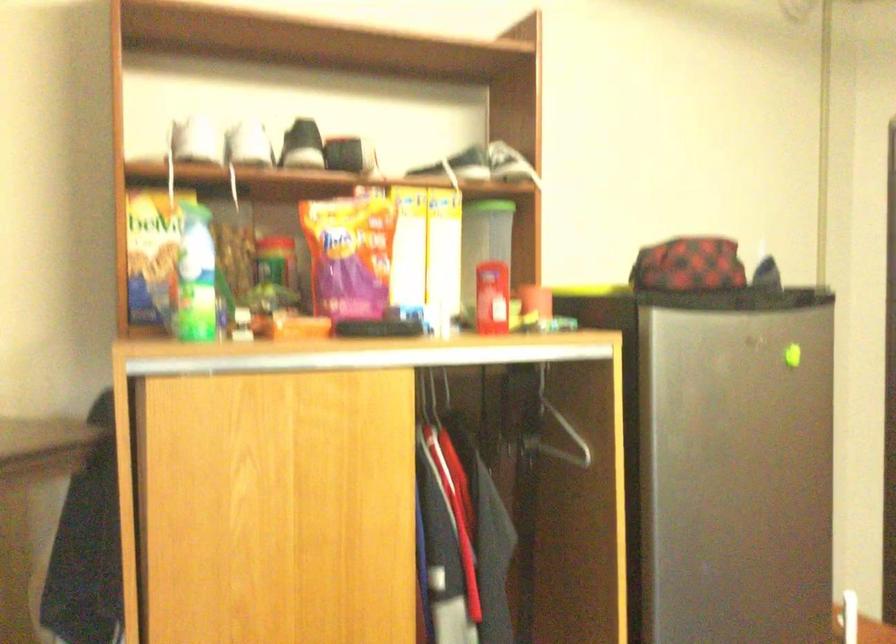
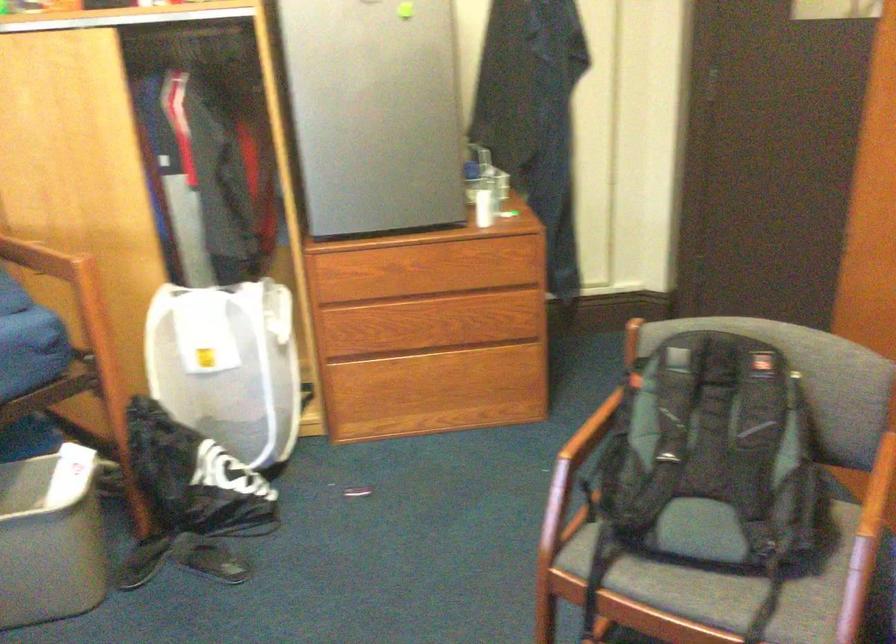
What movement of the cameraman would produce the second image?

The cameraman moved toward right, backward.